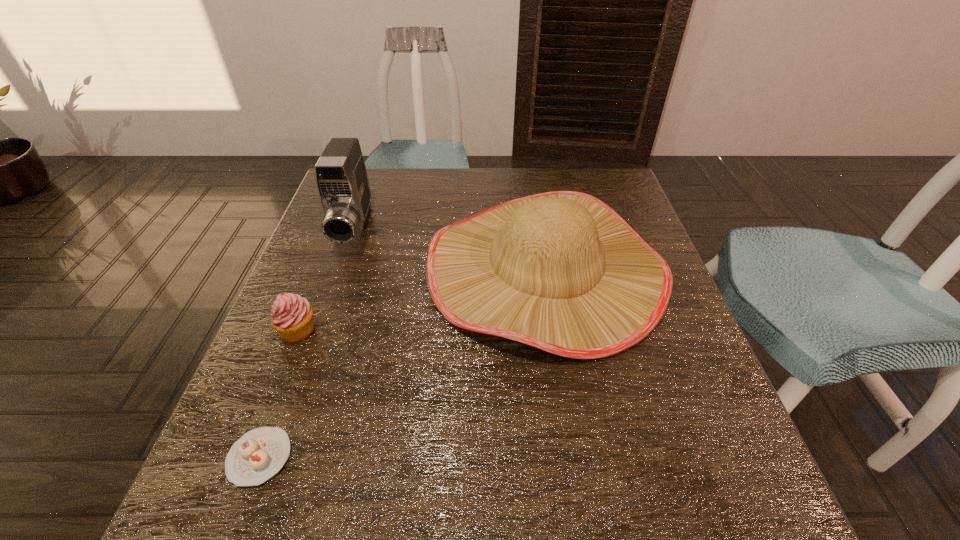
The height and width of the screenshot is (540, 960). In order to click on free space at the left edge in this screenshot , I will do `click(266, 345)`.

What are the coordinates of `vacant space at the right edge of the desktop` in the screenshot? It's located at (647, 348).

Find the location of a particular element. Image resolution: width=960 pixels, height=540 pixels. vacant area at the near right corner is located at coordinates (693, 526).

Find the location of a particular element. unoccupied area between the nearest object and the sunhat is located at coordinates (402, 363).

What are the coordinates of `free space between the rightmost object and the nearest object` in the screenshot? It's located at (402, 363).

Find the location of a particular element. This screenshot has width=960, height=540. free area in between the nearest object and the camcorder is located at coordinates (306, 343).

Locate an element on the screen. Image resolution: width=960 pixels, height=540 pixels. free space between the nearest object and the sunhat is located at coordinates (x=402, y=363).

Locate an element on the screen. This screenshot has height=540, width=960. free space between the rightmost object and the nearer cupcake is located at coordinates (402, 363).

Find the location of a particular element. free spot between the camcorder and the nearest object is located at coordinates (306, 343).

You are a GUI agent. You are given a task and a screenshot of the screen. Output one action in this format:
    pyautogui.click(x=<x>, y=<y>)
    Task: Click on the free point between the camcorder and the second shortest object
    Image resolution: width=960 pixels, height=540 pixels.
    Given the screenshot: What is the action you would take?
    pyautogui.click(x=325, y=279)